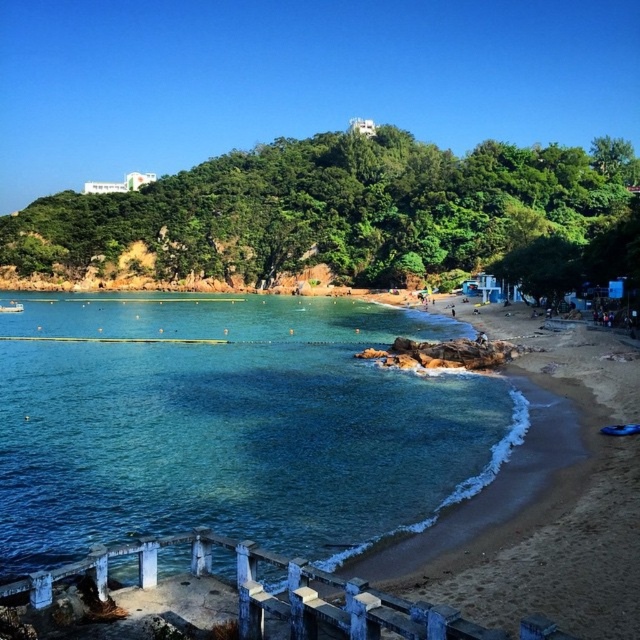
You are a photographer planning to capture the entire scene in one shot. Given that the clear blue water at lower left and the sandy beach at lower right are both in your frame, which of these two elements occupies more space in the image?

The clear blue water at lower left occupies more space in the image because it has a larger size compared to the sandy beach at lower right.

You are standing at the point marked as point (230, 426) in the image. Looking around, you see clear blue water at lower left. What direction would you face to look at the clear blue water at lower left?

You should face towards the lower left direction to look at the clear blue water at lower left located at point (230, 426).